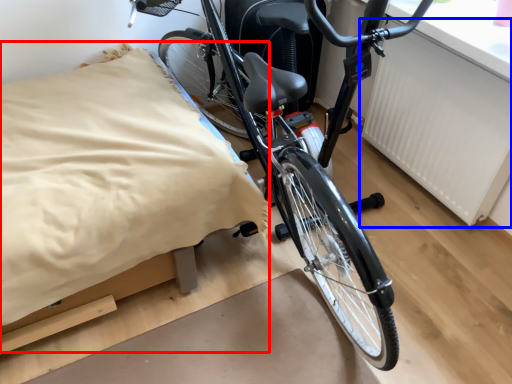
Question: Which object appears closest to the camera in this image, sheet (highlighted by a red box) or radiator (highlighted by a blue box)?

Choices:
 (A) sheet
 (B) radiator

Answer: (A)